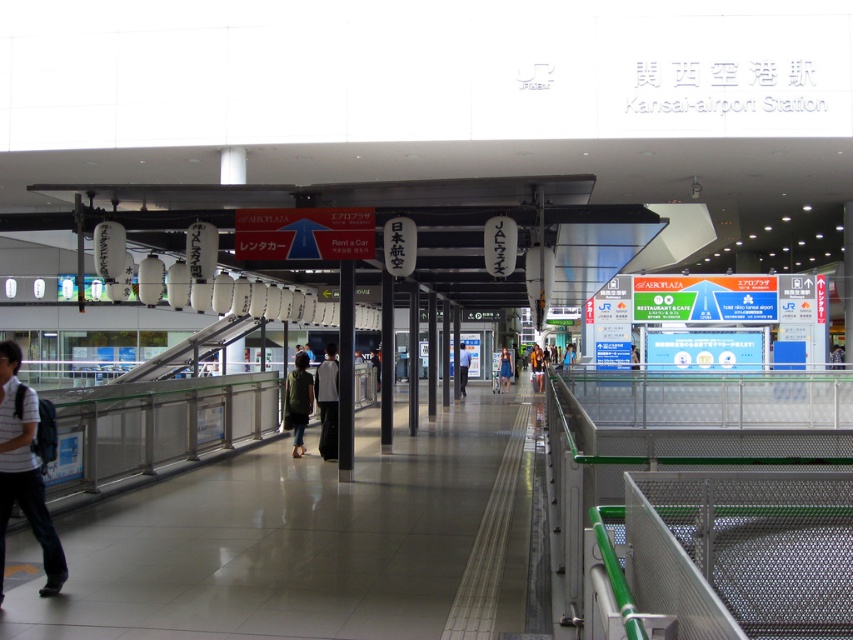
Question: Does dark gray fabric jacket at center have a greater width compared to orange fabric backpack at center?

Choices:
 (A) yes
 (B) no

Answer: (B)

Question: Is the position of dark gray fabric jacket at center more distant than that of blue denim jacket at center?

Choices:
 (A) no
 (B) yes

Answer: (A)

Question: In this image, where is orange fabric backpack at center located relative to light blue shirt at center?

Choices:
 (A) left
 (B) right

Answer: (B)

Question: Which of the following is the farthest from the observer?

Choices:
 (A) (323, 369)
 (B) (505, 372)

Answer: (B)

Question: Which point is closer to the camera?

Choices:
 (A) white striped shirt at lower left
 (B) green fabric shirt at center

Answer: (A)

Question: Which point is farther to the camera?

Choices:
 (A) dark gray fabric jacket at center
 (B) white striped shirt at lower left
 (C) orange fabric backpack at center

Answer: (C)